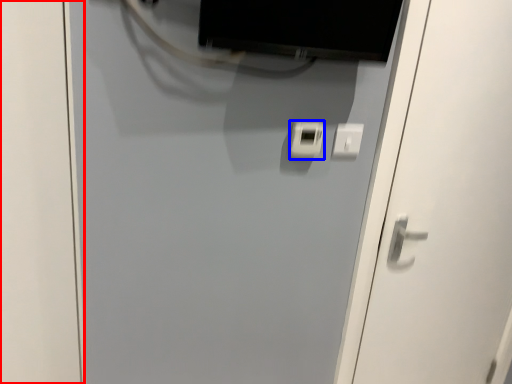
Question: Which of the following is the closest to the observer, door (highlighted by a red box) or light switch (highlighted by a blue box)?

Choices:
 (A) door
 (B) light switch

Answer: (A)